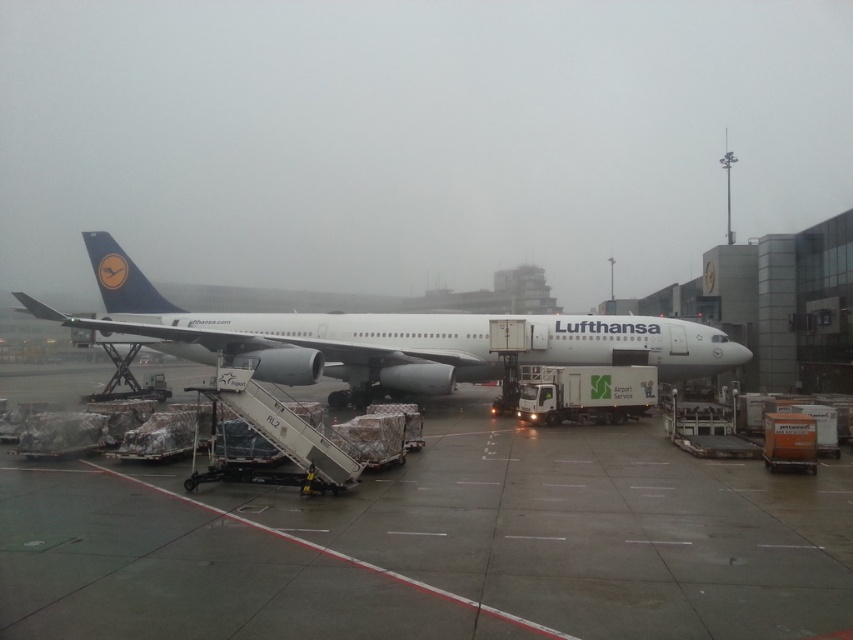
Is point (151, 496) more distant than point (396, 376)?

No, it is in front of (396, 376).

Describe the element at coordinates (434, 545) in the screenshot. I see `concrete tarmac at center` at that location.

Where is `concrete tarmac at center`? concrete tarmac at center is located at coordinates (434, 545).